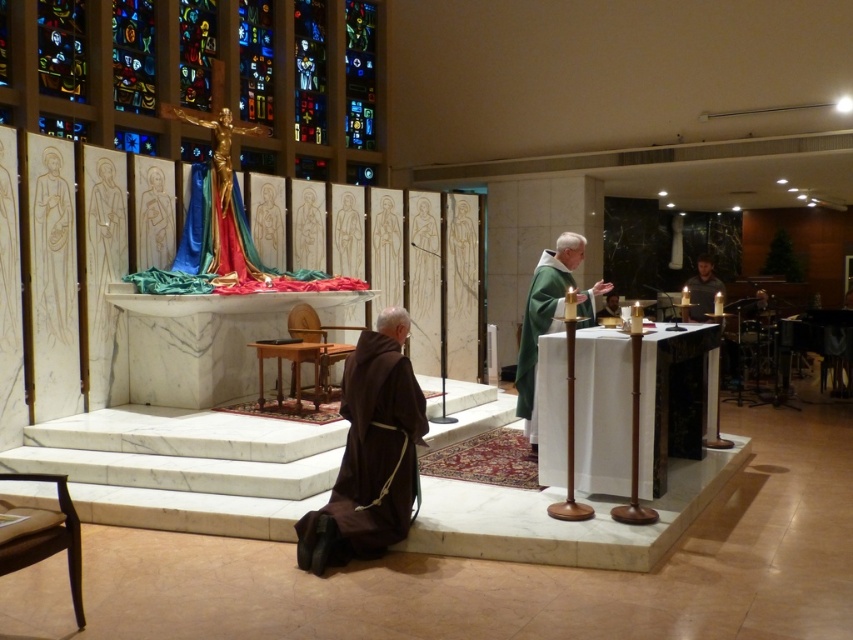
Between green cloth at right and matte gold statue at center, which one has more height?

green cloth at right is taller.

Can you confirm if green cloth at right is bigger than matte gold statue at center?

Yes, green cloth at right is bigger than matte gold statue at center.

Identify the location of green cloth at right. (550, 317).

Can you confirm if brown cloth at lower left is bigger than matte gold statue at center?

Indeed, brown cloth at lower left has a larger size compared to matte gold statue at center.

Does point (355, 388) lie behind point (334, 250)?

No, (355, 388) is closer to viewer.

You are a GUI agent. You are given a task and a screenshot of the screen. Output one action in this format:
    pyautogui.click(x=<x>, y=<y>)
    Task: Click on the brown cloth at lower left
    
    Given the screenshot: What is the action you would take?
    tap(369, 460)

Between brown cloth at lower left and smooth gold statue at center, which one is positioned lower?

Positioned lower is brown cloth at lower left.

Can you confirm if brown cloth at lower left is wider than smooth gold statue at center?

Indeed, brown cloth at lower left has a greater width compared to smooth gold statue at center.

At what (x,y) coordinates should I click in order to perform the action: click on brown cloth at lower left. Please return your answer as a coordinate pair (x, y). The image size is (853, 640). Looking at the image, I should click on pyautogui.click(x=369, y=460).

The height and width of the screenshot is (640, 853). Find the location of `brown cloth at lower left`. brown cloth at lower left is located at coordinates (369, 460).